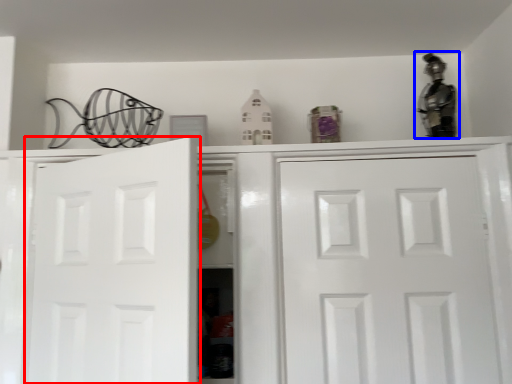
Question: Which object appears closest to the camera in this image, door (highlighted by a red box) or figurine (highlighted by a blue box)?

Choices:
 (A) door
 (B) figurine

Answer: (A)